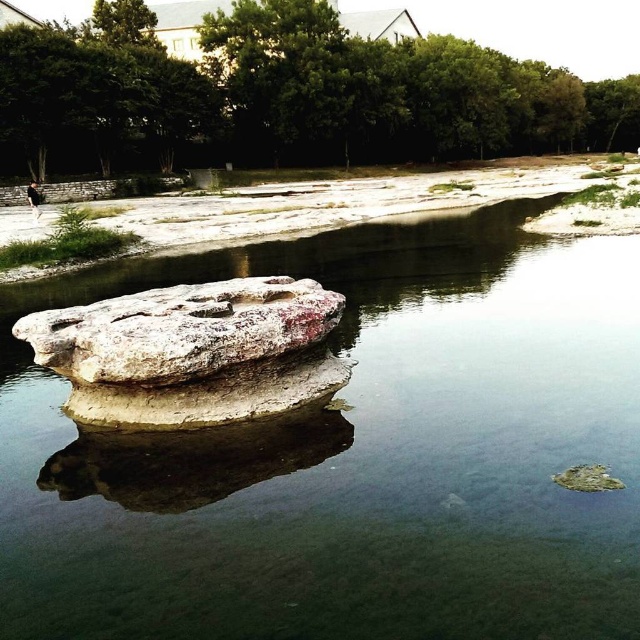
Which of these two, clear water at center or green leafy tree at upper center, stands shorter?

With less height is clear water at center.

Can you confirm if clear water at center is smaller than green leafy tree at upper center?

Correct, clear water at center occupies less space than green leafy tree at upper center.

The image size is (640, 640). What do you see at coordinates (352, 456) in the screenshot?
I see `clear water at center` at bounding box center [352, 456].

Find the location of a particular element. This screenshot has width=640, height=640. clear water at center is located at coordinates (352, 456).

This screenshot has height=640, width=640. What do you see at coordinates (282, 92) in the screenshot?
I see `green leafy tree at upper center` at bounding box center [282, 92].

Can you confirm if green leafy tree at upper center is taller than white rough rock at center?

Correct, green leafy tree at upper center is much taller as white rough rock at center.

Does point (349, 92) come farther from viewer compared to point (74, 365)?

Yes, point (349, 92) is behind point (74, 365).

Find the location of a particular element. Image resolution: width=640 pixels, height=640 pixels. green leafy tree at upper center is located at coordinates (282, 92).

Does point (92, 580) come closer to viewer compared to point (248, 362)?

Yes, it is.

Is the position of clear water at center less distant than that of white rough rock at center?

Yes, it is.

Is point (556, 502) in front of point (241, 305)?

Yes, it is.

This screenshot has width=640, height=640. What are the coordinates of `clear water at center` in the screenshot? It's located at (352, 456).